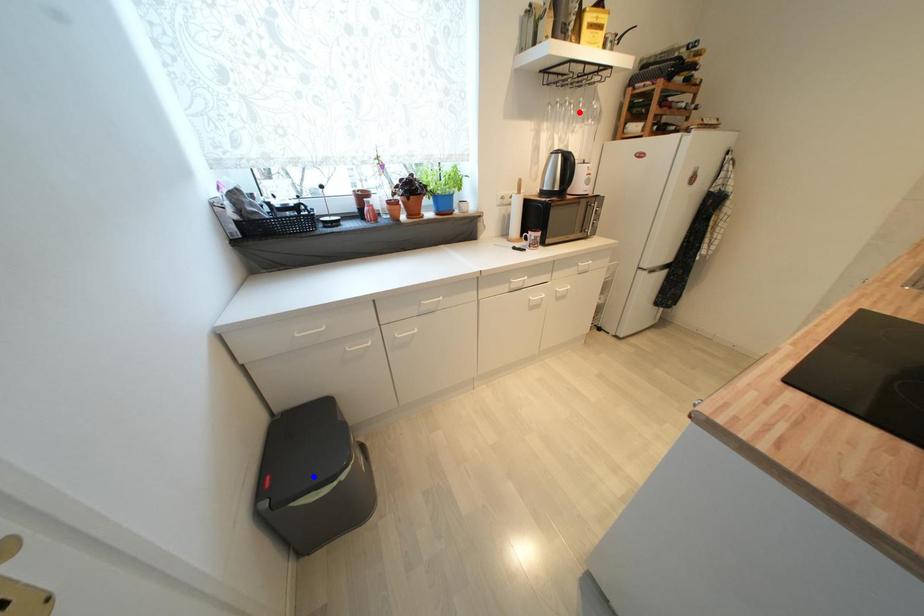
Question: Two points are marked on the image. Which point is closer to the camera?

Choices:
 (A) Blue point is closer.
 (B) Red point is closer.

Answer: (A)